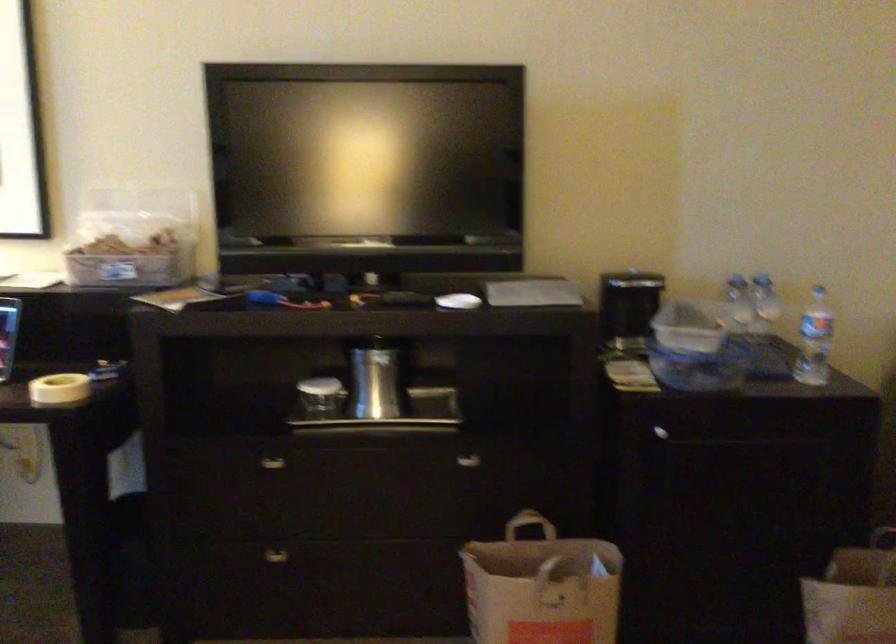
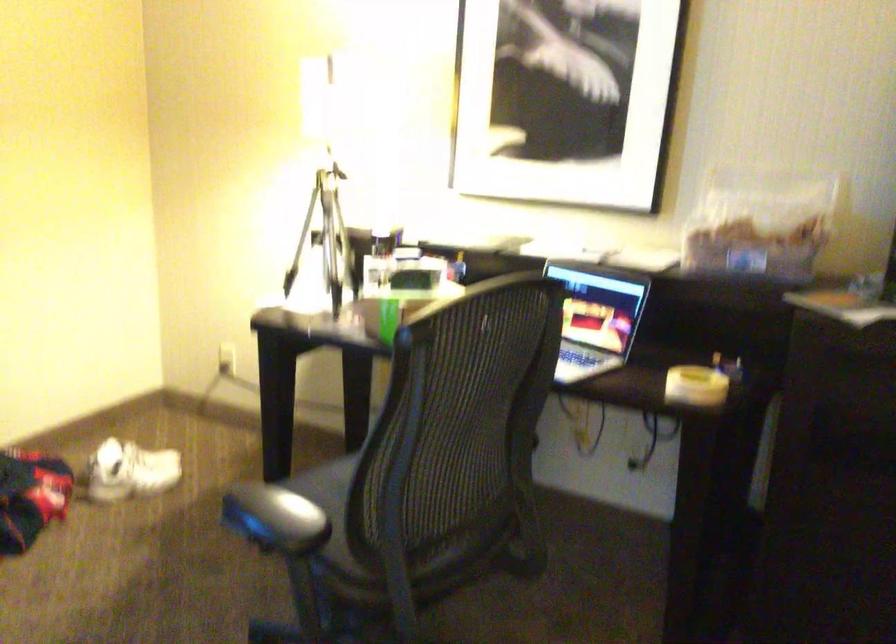
Question: Which direction would the cameraman need to move to produce the second image? Reply with the corresponding letter.

Choices:
 (A) Left
 (B) Right
 (C) Forward
 (D) Backward

Answer: (A)